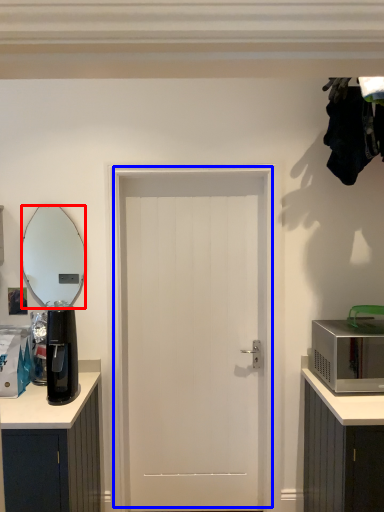
Question: Which point is further to the camera, mirror (highlighted by a red box) or door (highlighted by a blue box)?

Choices:
 (A) mirror
 (B) door

Answer: (A)